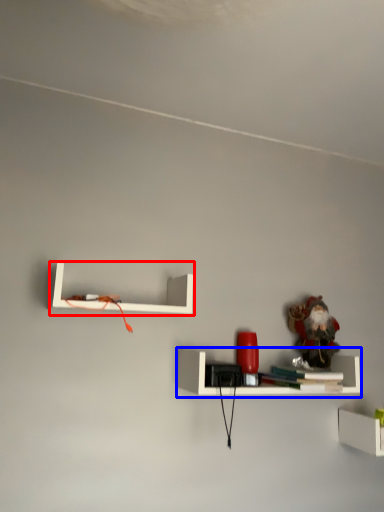
Question: Which of the following is the farthest to the observer, shelf (highlighted by a red box) or shelf (highlighted by a blue box)?

Choices:
 (A) shelf
 (B) shelf

Answer: (B)